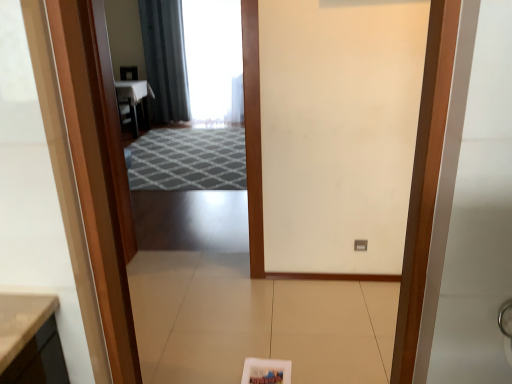
Question: In the image, is wooden door at center on the left side or the right side of gray textured rug at center?

Choices:
 (A) left
 (B) right

Answer: (B)

Question: Looking at their shapes, would you say wooden door at center is wider or thinner than gray textured rug at center?

Choices:
 (A) thin
 (B) wide

Answer: (A)

Question: Considering the real-world distances, which object is closest to the gray textured rug at center?

Choices:
 (A) wooden door at center
 (B) dark gray fabric curtain at upper center

Answer: (B)

Question: Estimate the real-world distances between objects in this image. Which object is closer to the gray textured rug at center?

Choices:
 (A) wooden door at center
 (B) dark gray fabric curtain at upper center

Answer: (B)